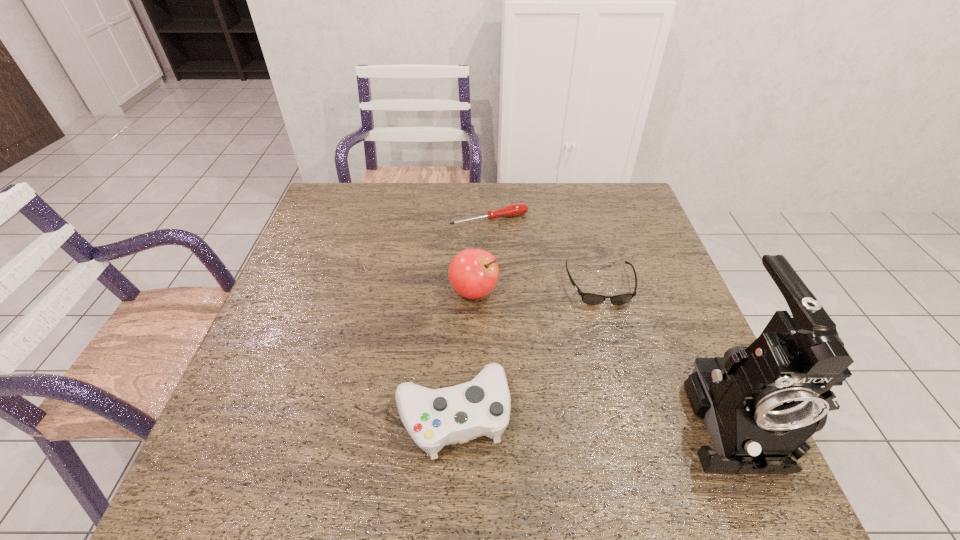
What are the coordinates of `free space on the desktop that is between the control and the camcorder and is positioned at the tip of the farthest object` in the screenshot? It's located at 607,414.

Image resolution: width=960 pixels, height=540 pixels. I want to click on free space on the desktop that is between the control and the camcorder and is positioned on the stem of the apple, so click(567, 414).

This screenshot has height=540, width=960. What are the coordinates of `free space on the desktop that is between the third tallest object and the camcorder and is positioned on the front-facing side of the sunglasses` in the screenshot? It's located at (634, 414).